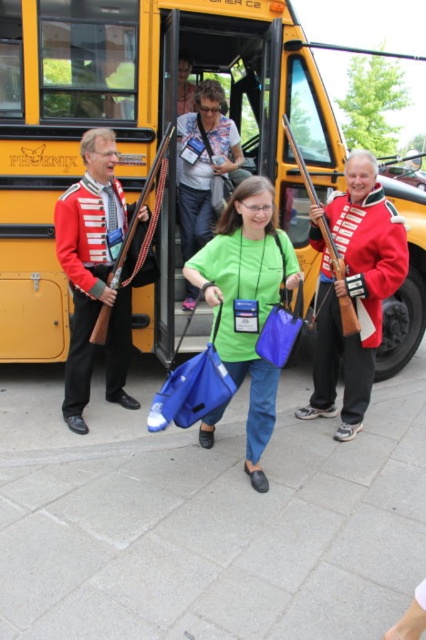
Question: Can you confirm if wooden rifle at left is positioned below wooden rifle at center?

Choices:
 (A) yes
 (B) no

Answer: (A)

Question: Which point appears closest to the camera in this image?

Choices:
 (A) (221, 380)
 (B) (288, 132)

Answer: (A)

Question: Can you confirm if red wool coat at right is positioned to the right of wooden rifle at center?

Choices:
 (A) yes
 (B) no

Answer: (A)

Question: Can you confirm if green matte shirt at center is positioned below wooden rifle at left?

Choices:
 (A) yes
 (B) no

Answer: (A)

Question: Among these objects, which one is nearest to the camera?

Choices:
 (A) red wool coat at right
 (B) shiny red uniform at left
 (C) yellow matte school bus at center
 (D) denim jacket at center

Answer: (A)

Question: Considering the real-world distances, which object is farthest from the wooden rifle at center?

Choices:
 (A) yellow matte school bus at center
 (B) red wool coat at right

Answer: (A)